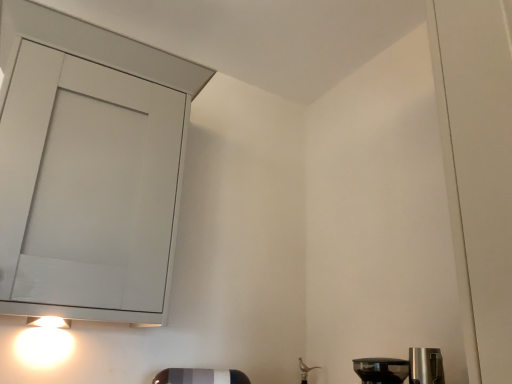
Question: Considering the relative positions of white glossy light at lower left and matte white cabinet at upper left in the image provided, is white glossy light at lower left to the right of matte white cabinet at upper left from the viewer's perspective?

Choices:
 (A) no
 (B) yes

Answer: (A)

Question: Is white glossy light at lower left facing away from matte white cabinet at upper left?

Choices:
 (A) yes
 (B) no

Answer: (B)

Question: Does white glossy light at lower left have a lesser width compared to matte white cabinet at upper left?

Choices:
 (A) yes
 (B) no

Answer: (A)

Question: Is white glossy light at lower left positioned beyond the bounds of matte white cabinet at upper left?

Choices:
 (A) yes
 (B) no

Answer: (A)

Question: Is white glossy light at lower left at the left side of matte white cabinet at upper left?

Choices:
 (A) yes
 (B) no

Answer: (A)

Question: From the image's perspective, is white glossy light at lower left below matte white cabinet at upper left?

Choices:
 (A) yes
 (B) no

Answer: (A)

Question: Considering the relative positions of matte white cabinet at upper left and white glossy light at lower left in the image provided, is matte white cabinet at upper left behind white glossy light at lower left?

Choices:
 (A) no
 (B) yes

Answer: (A)

Question: Would you consider matte white cabinet at upper left to be distant from white glossy light at lower left?

Choices:
 (A) yes
 (B) no

Answer: (B)

Question: From a real-world perspective, is matte white cabinet at upper left physically below white glossy light at lower left?

Choices:
 (A) yes
 (B) no

Answer: (B)

Question: From the image's perspective, is matte white cabinet at upper left on white glossy light at lower left?

Choices:
 (A) yes
 (B) no

Answer: (A)

Question: From a real-world perspective, is matte white cabinet at upper left located higher than white glossy light at lower left?

Choices:
 (A) yes
 (B) no

Answer: (A)

Question: From the image's perspective, does matte white cabinet at upper left appear lower than white glossy light at lower left?

Choices:
 (A) yes
 (B) no

Answer: (B)

Question: Are transparent plastic coffee maker at lower right and white glossy light at lower left making contact?

Choices:
 (A) yes
 (B) no

Answer: (B)